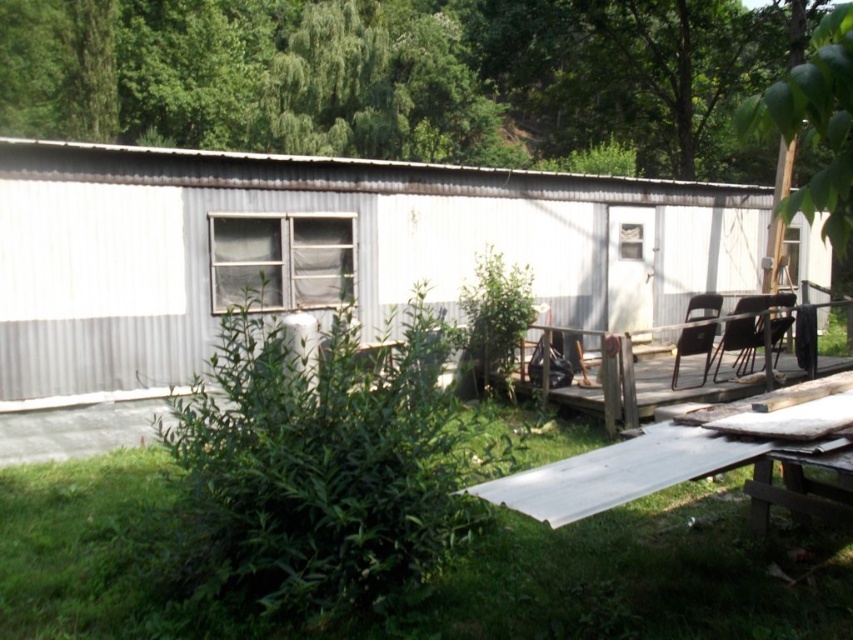
Measure the distance between white corrugated metal hut at center and camera.

white corrugated metal hut at center is 6.94 meters away from camera.

Is white corrugated metal hut at center thinner than green leafy tree at upper right?

No, white corrugated metal hut at center is not thinner than green leafy tree at upper right.

Which is in front, point (717, 276) or point (809, 202)?

Point (809, 202) is in front.

You are a GUI agent. You are given a task and a screenshot of the screen. Output one action in this format:
    pyautogui.click(x=<x>, y=<y>)
    Task: Click on the white corrugated metal hut at center
    Image resolution: width=853 pixels, height=640 pixels.
    Given the screenshot: What is the action you would take?
    pyautogui.click(x=318, y=252)

This screenshot has height=640, width=853. Find the location of `green leafy tree at upper center`. green leafy tree at upper center is located at coordinates (405, 77).

Can you confirm if green leafy tree at upper center is bigger than green leafy tree at upper right?

Indeed, green leafy tree at upper center has a larger size compared to green leafy tree at upper right.

Describe the element at coordinates (405, 77) in the screenshot. This screenshot has width=853, height=640. I see `green leafy tree at upper center` at that location.

At what (x,y) coordinates should I click in order to perform the action: click on green leafy tree at upper center. Please return your answer as a coordinate pair (x, y). The height and width of the screenshot is (640, 853). Looking at the image, I should click on (405, 77).

Is point (579, 472) closer to viewer compared to point (727, 397)?

That is True.

Is point (573, 509) behind point (515, 372)?

No, it is in front of (515, 372).

Who is more distant from viewer, (x=645, y=481) or (x=582, y=397)?

Point (x=582, y=397)

Where is `metallic silver table at lower right`? This screenshot has height=640, width=853. metallic silver table at lower right is located at coordinates (618, 472).